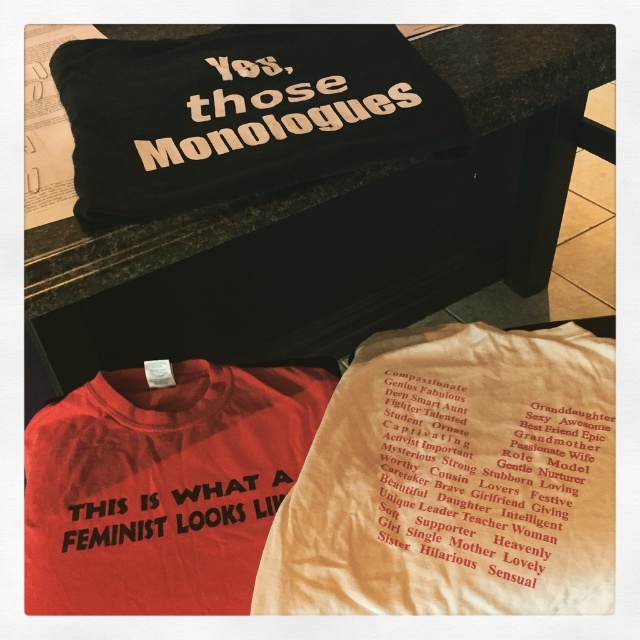
You are organizing a display of these tshirts and need to ensure the black fabric pillow at upper center and the black fabric text at center are arranged correctly according to their positions. Which object is located to the right of the other?

The black fabric pillow at upper center is positioned on the right side of black fabric text at center.

You are standing 1.5 meters away from the camera. Is the point at coordinate (308, 294) within your reach?

The point at coordinate (308, 294) is 1.45 meters away from the camera, so yes, you can reach it since you are standing 1.5 meters away from the camera.

Where is the black fabric pillow at upper center located in the image?

The black fabric pillow at upper center is located at point 0.359 in the x coordinate and 0.528 in the y coordinate.